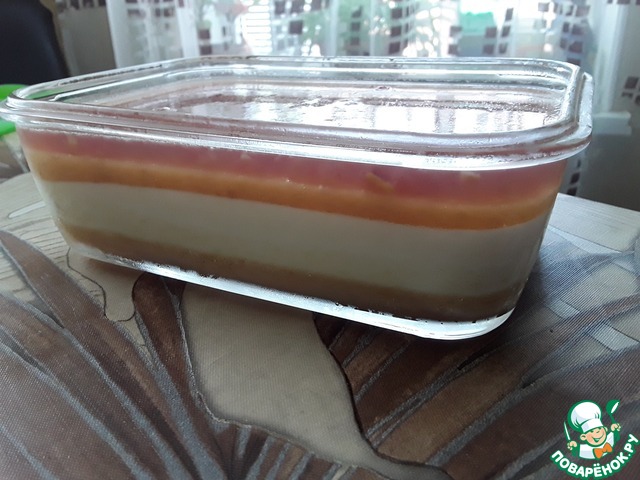
Find the location of a particular element. The image size is (640, 480). curtains is located at coordinates (92, 33), (564, 26), (324, 16).